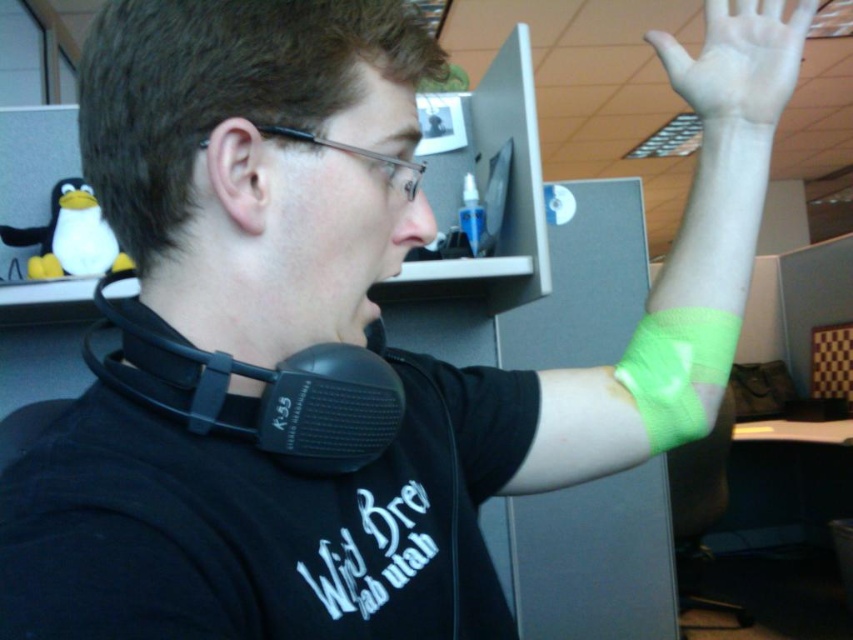
Question: Which object appears farthest from the camera in this image?

Choices:
 (A) neon green mesh wristband at upper right
 (B) green fabric wristband at upper right
 (C) green fabric bandage at upper right

Answer: (A)

Question: Among these objects, which one is nearest to the camera?

Choices:
 (A) neon green mesh wristband at upper right
 (B) black matte headphones at center
 (C) green fabric wristband at upper right
 (D) green fabric bandage at upper right

Answer: (B)

Question: Can you confirm if green fabric wristband at upper right is positioned above black matte headphones at center?

Choices:
 (A) yes
 (B) no

Answer: (A)

Question: Does green fabric wristband at upper right appear under black matte headphones at center?

Choices:
 (A) no
 (B) yes

Answer: (A)

Question: From the image, what is the correct spatial relationship of green fabric bandage at upper right in relation to neon green mesh wristband at upper right?

Choices:
 (A) above
 (B) below

Answer: (A)

Question: Which of the following is the closest to the observer?

Choices:
 (A) black matte headphones at center
 (B) green fabric wristband at upper right
 (C) green fabric bandage at upper right

Answer: (A)